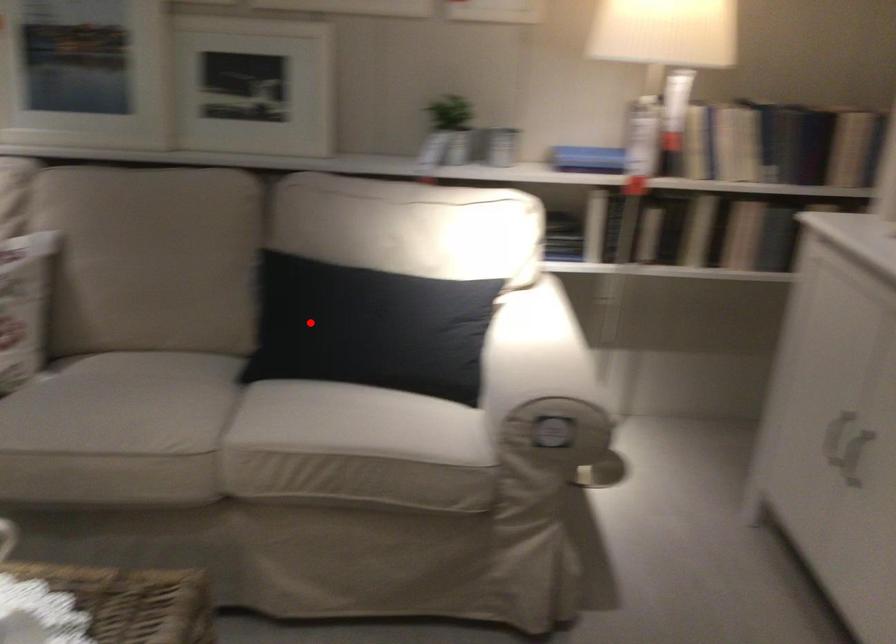
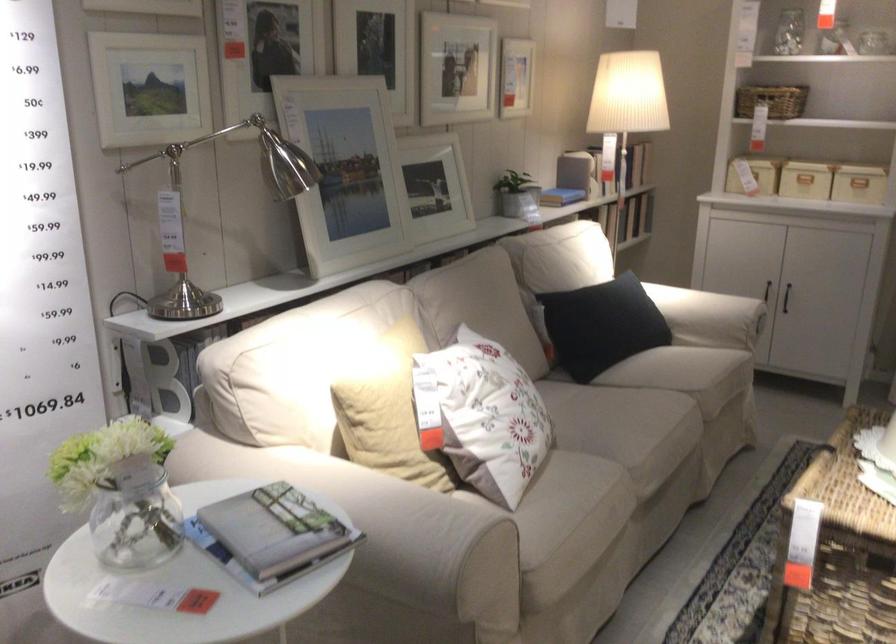
Where in the second image is the point corresponding to the highlighted location from the first image?

(600, 325)